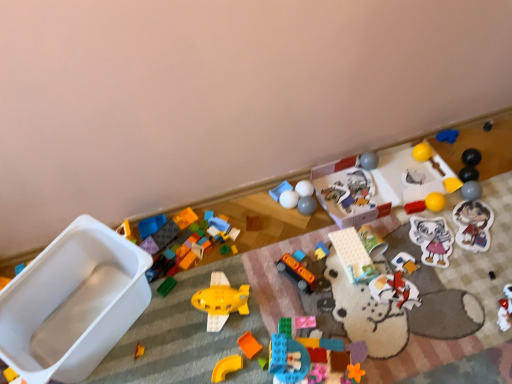
Locate an element on the screen. vacant area situated to the left side of matte gray ball at center, which appears as the 14th toy when viewed from the left is located at coordinates (263, 219).